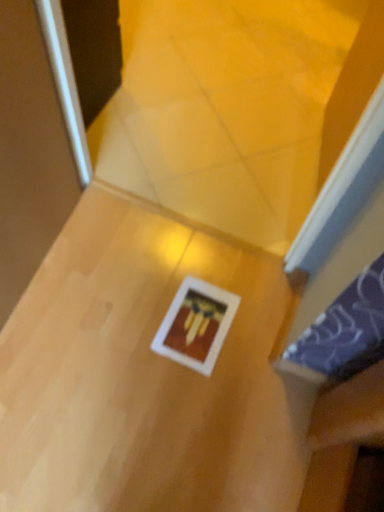
Question: From the image's perspective, is white matte picture frame at center above or below wooden table at center?

Choices:
 (A) below
 (B) above

Answer: (B)

Question: Does point (221, 315) appear closer or farther from the camera than point (190, 455)?

Choices:
 (A) farther
 (B) closer

Answer: (A)

Question: Is white matte picture frame at center bigger or smaller than wooden table at center?

Choices:
 (A) big
 (B) small

Answer: (B)

Question: In the image, is wooden table at center on the left side or the right side of white matte picture frame at center?

Choices:
 (A) left
 (B) right

Answer: (A)

Question: Considering the positions of wooden table at center and white matte picture frame at center in the image, is wooden table at center wider or thinner than white matte picture frame at center?

Choices:
 (A) thin
 (B) wide

Answer: (B)

Question: From the image's perspective, is wooden table at center positioned above or below white matte picture frame at center?

Choices:
 (A) below
 (B) above

Answer: (A)

Question: From their relative heights in the image, would you say wooden table at center is taller or shorter than white matte picture frame at center?

Choices:
 (A) tall
 (B) short

Answer: (A)